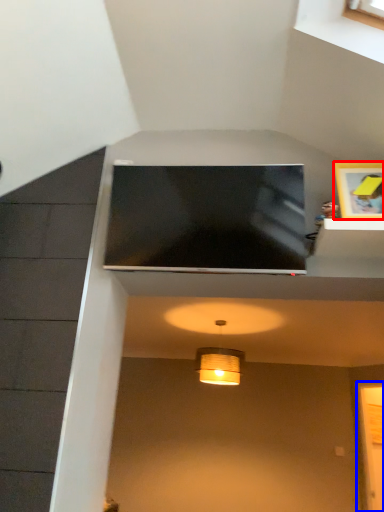
Question: Which object appears farthest to the camera in this image, picture frame (highlighted by a red box) or glass door (highlighted by a blue box)?

Choices:
 (A) picture frame
 (B) glass door

Answer: (B)